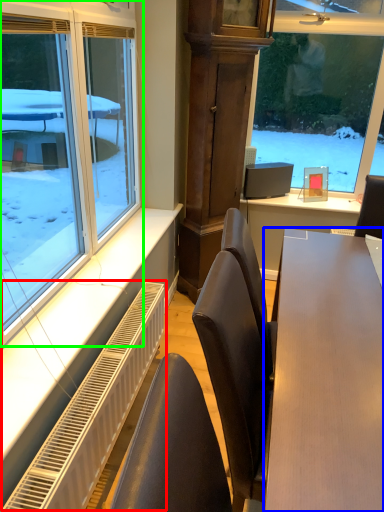
Question: Which object is the closest to the radiator (highlighted by a red box)? Choose among these: table (highlighted by a blue box) or window (highlighted by a green box).

Choices:
 (A) table
 (B) window

Answer: (B)